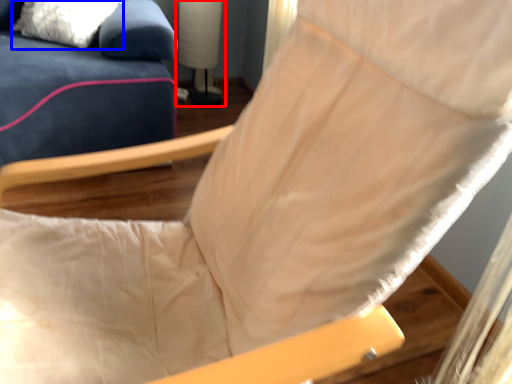
Question: Which of the following is the closest to the observer, table lamp (highlighted by a red box) or pillow (highlighted by a blue box)?

Choices:
 (A) table lamp
 (B) pillow

Answer: (B)